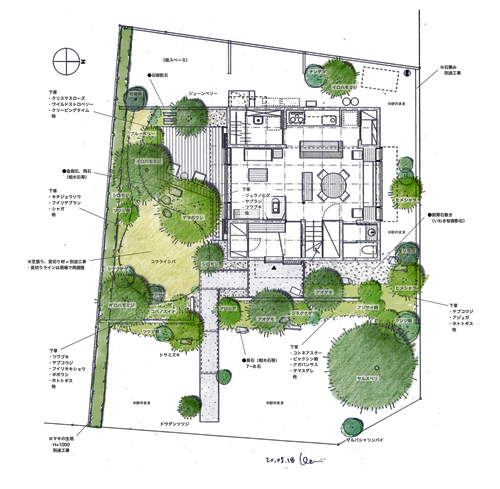
You are a GUI agent. You are given a task and a screenshot of the screen. Output one action in this format:
    pyautogui.click(x=<x>, y=<y>)
    Task: Click on the table
    This screenshot has width=500, height=489.
    Given the screenshot: What is the action you would take?
    pyautogui.click(x=332, y=201)